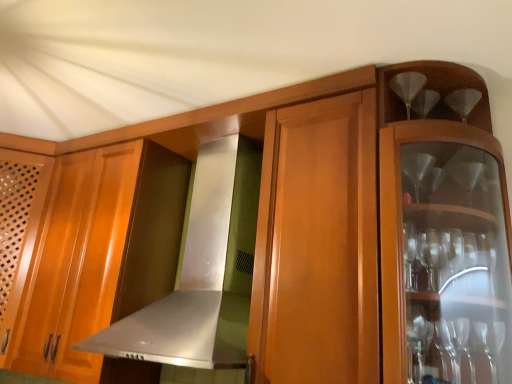
Question: Is satin silver exhaust hood at center positioned with its back to clear glass wine glass at upper right?

Choices:
 (A) no
 (B) yes

Answer: (A)

Question: From the image's perspective, is satin silver exhaust hood at center located above clear glass wine glass at upper right?

Choices:
 (A) yes
 (B) no

Answer: (B)

Question: Is satin silver exhaust hood at center thinner than clear glass wine glass at upper right?

Choices:
 (A) no
 (B) yes

Answer: (A)

Question: Considering the relative sizes of satin silver exhaust hood at center and clear glass wine glass at upper right in the image provided, is satin silver exhaust hood at center wider than clear glass wine glass at upper right?

Choices:
 (A) no
 (B) yes

Answer: (B)

Question: Does satin silver exhaust hood at center come in front of clear glass wine glass at upper right?

Choices:
 (A) yes
 (B) no

Answer: (A)

Question: Considering the positions of wooden cabinet at left and satin silver exhaust hood at center in the image, is wooden cabinet at left taller or shorter than satin silver exhaust hood at center?

Choices:
 (A) tall
 (B) short

Answer: (A)

Question: Relative to satin silver exhaust hood at center, is wooden cabinet at left in front or behind?

Choices:
 (A) front
 (B) behind

Answer: (B)

Question: From a real-world perspective, is wooden cabinet at left above or below satin silver exhaust hood at center?

Choices:
 (A) above
 (B) below

Answer: (B)

Question: Does point (35, 228) appear closer or farther from the camera than point (155, 312)?

Choices:
 (A) closer
 (B) farther

Answer: (B)

Question: Would you say satin silver exhaust hood at center is inside or outside wooden cabinet at left?

Choices:
 (A) inside
 (B) outside

Answer: (B)

Question: Relative to wooden cabinet at left, is satin silver exhaust hood at center in front or behind?

Choices:
 (A) front
 (B) behind

Answer: (A)

Question: From a real-world perspective, is satin silver exhaust hood at center physically located above or below wooden cabinet at left?

Choices:
 (A) above
 (B) below

Answer: (A)

Question: In terms of height, does satin silver exhaust hood at center look taller or shorter compared to wooden cabinet at left?

Choices:
 (A) short
 (B) tall

Answer: (A)

Question: From a real-world perspective, relative to clear glass wine glass at upper right, is satin silver exhaust hood at center vertically above or below?

Choices:
 (A) below
 (B) above

Answer: (A)

Question: Is satin silver exhaust hood at center spatially inside clear glass wine glass at upper right, or outside of it?

Choices:
 (A) outside
 (B) inside

Answer: (A)